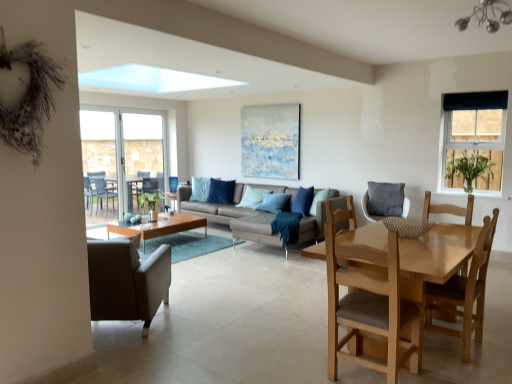
Question: Are leather couch at center and light brown wooden chair at lower right, which is counted as the fourth chair, starting from the back, far apart?

Choices:
 (A) no
 (B) yes

Answer: (B)

Question: From the image's perspective, does leather couch at center appear higher than light brown wooden chair at lower right, which is counted as the fourth chair, starting from the back?

Choices:
 (A) no
 (B) yes

Answer: (B)

Question: Does leather couch at center have a greater height compared to light brown wooden chair at lower right, positioned as the second chair in left-to-right order?

Choices:
 (A) yes
 (B) no

Answer: (B)

Question: Would you say light brown wooden chair at lower right, marked as the 3th chair in a right-to-left arrangement, is part of leather couch at center's contents?

Choices:
 (A) no
 (B) yes

Answer: (A)

Question: Does leather couch at center appear on the right side of light brown wooden chair at lower right, positioned as the second chair in left-to-right order?

Choices:
 (A) yes
 (B) no

Answer: (B)

Question: Considering the relative positions of leather couch at center and light brown wooden chair at lower right, which is counted as the fourth chair, starting from the back, in the image provided, is leather couch at center behind light brown wooden chair at lower right, which is counted as the fourth chair, starting from the back,?

Choices:
 (A) yes
 (B) no

Answer: (A)

Question: From the image's perspective, is chrome metallic chandelier at upper right on top of clear glass door at left, placed as the 1th screen door when sorted from right to left?

Choices:
 (A) yes
 (B) no

Answer: (A)

Question: Can you confirm if chrome metallic chandelier at upper right is bigger than clear glass door at left, placed as the 1th screen door when sorted from right to left?

Choices:
 (A) no
 (B) yes

Answer: (A)

Question: From a real-world perspective, is chrome metallic chandelier at upper right below clear glass door at left, placed as the 2th screen door when sorted from left to right?

Choices:
 (A) no
 (B) yes

Answer: (A)

Question: Is chrome metallic chandelier at upper right outside of clear glass door at left, placed as the 1th screen door when sorted from right to left?

Choices:
 (A) yes
 (B) no

Answer: (A)

Question: Does chrome metallic chandelier at upper right touch clear glass door at left, placed as the 2th screen door when sorted from left to right?

Choices:
 (A) no
 (B) yes

Answer: (A)

Question: Is chrome metallic chandelier at upper right far away from clear glass door at left, placed as the 2th screen door when sorted from left to right?

Choices:
 (A) no
 (B) yes

Answer: (B)

Question: Can dark blue fabric curtain at upper right, the 2th window from the back, be found inside light blue fabric pillow at center, positioned as the 2th pillow in right-to-left order?

Choices:
 (A) yes
 (B) no

Answer: (B)